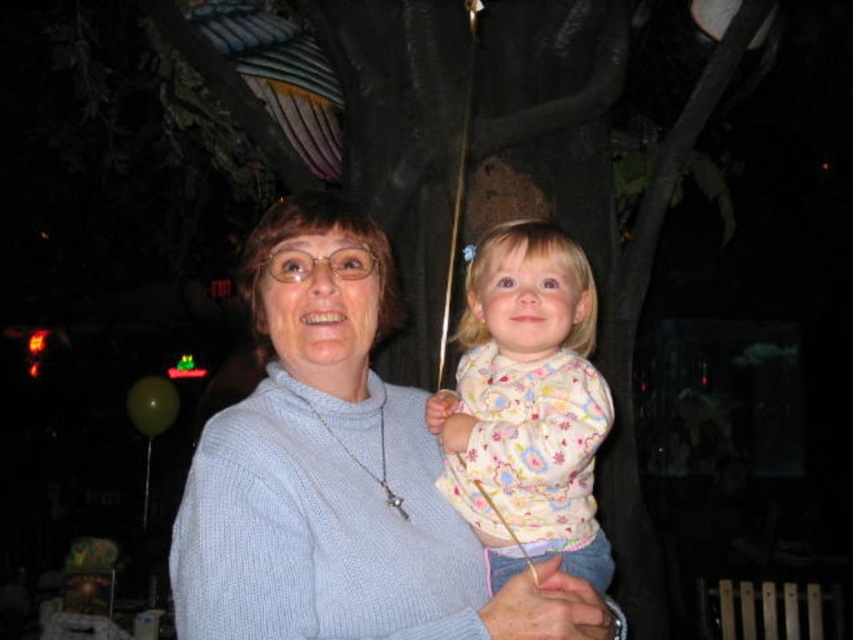
You are a photographer trying to capture a closeup of the light blue sweater at center in the nighttime scene. The camera you are using has a focus point at coordinates point (x=338, y=474). Is this focus point correctly positioned to capture the light blue sweater at center?

Yes, the focus point at point (x=338, y=474) is correctly positioned because the Objects Description states that this point marks the light blue sweater at center.

You are a photographer trying to capture a closeup shot of the light blue sweater at center and the fluffy cotton sweater at center. Your camera has a minimum focus distance of 8 inches. Can you focus on both sweaters at the same time?

The distance between the light blue sweater at center and the fluffy cotton sweater at center is 8.72 inches. Since the minimum focus distance is 8 inches, the camera can focus on both sweaters simultaneously as the separation between them is within the required range.

You are a photographer trying to capture a closeup of the child in the light blue sweater at center and the fluffy cotton sweater at center. Since the camera can only focus on one object at a time, which sweater should you focus on to ensure the child is in focus?

The light blue sweater at center is taller than the fluffy cotton sweater at center, so focusing on the light blue sweater at center will ensure the child is in focus.